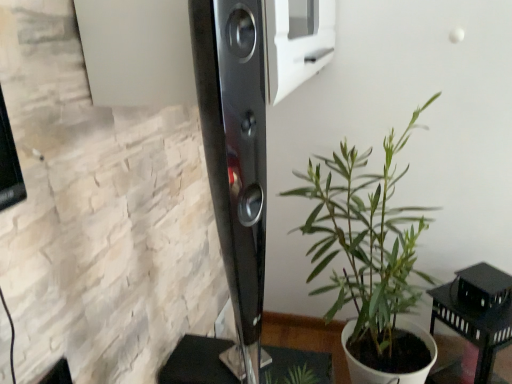
The image size is (512, 384). In order to click on green leafy plant at center in this screenshot , I will do `click(370, 261)`.

The width and height of the screenshot is (512, 384). Describe the element at coordinates (370, 261) in the screenshot. I see `green leafy plant at center` at that location.

What do you see at coordinates (477, 312) in the screenshot? I see `black matte table at lower right` at bounding box center [477, 312].

I want to click on black matte table at lower right, so click(x=477, y=312).

Identify the location of green leafy plant at center. The height and width of the screenshot is (384, 512). (370, 261).

Considering the positions of objects black matte table at lower right and green leafy plant at center in the image provided, who is more to the left, black matte table at lower right or green leafy plant at center?

green leafy plant at center.

Is black matte table at lower right closer to the viewer compared to green leafy plant at center?

That is False.

Which is in front, point (485, 264) or point (354, 367)?

Point (354, 367)

From the image's perspective, between black matte table at lower right and green leafy plant at center, which one is located above?

green leafy plant at center, from the image's perspective.

From a real-world perspective, between black matte table at lower right and green leafy plant at center, who is vertically higher?

green leafy plant at center.

Considering the sizes of objects black matte table at lower right and green leafy plant at center in the image provided, who is thinner, black matte table at lower right or green leafy plant at center?

Thinner between the two is black matte table at lower right.

Between black matte table at lower right and green leafy plant at center, which one has less height?

With less height is black matte table at lower right.

Does black matte table at lower right have a larger size compared to green leafy plant at center?

No, black matte table at lower right is not bigger than green leafy plant at center.

Is green leafy plant at center surrounded by black matte table at lower right?

No, green leafy plant at center is not inside black matte table at lower right.

Is black matte table at lower right far from green leafy plant at center?

No, black matte table at lower right is in close proximity to green leafy plant at center.

Is black matte table at lower right facing away from green leafy plant at center?

That's right, black matte table at lower right is facing away from green leafy plant at center.

What's the angular difference between black matte table at lower right and green leafy plant at center's facing directions?

black matte table at lower right and green leafy plant at center are facing 48.2 degrees away from each other.

Looking at this image, how much distance is there between black matte table at lower right and green leafy plant at center?

black matte table at lower right is 11.13 inches from green leafy plant at center.

Locate an element on the screen. houseplant that is above the black matte table at lower right (from the image's perspective) is located at coordinates (370, 261).

Is green leafy plant at center to the left of black matte table at lower right from the viewer's perspective?

Indeed, green leafy plant at center is positioned on the left side of black matte table at lower right.

Considering their positions, is green leafy plant at center located in front of or behind black matte table at lower right?

Clearly, green leafy plant at center is in front of black matte table at lower right.

Is point (411, 231) positioned before point (449, 292)?

No, it is not.

From the image's perspective, is green leafy plant at center above black matte table at lower right?

Yes.

From a real-world perspective, which object rests below the other?

black matte table at lower right, from a real-world perspective.

Based on the photo, is green leafy plant at center wider than black matte table at lower right?

Yes, green leafy plant at center is wider than black matte table at lower right.

In terms of height, does green leafy plant at center look taller or shorter compared to black matte table at lower right?

Clearly, green leafy plant at center is taller compared to black matte table at lower right.

In terms of size, does green leafy plant at center appear bigger or smaller than black matte table at lower right?

Clearly, green leafy plant at center is larger in size than black matte table at lower right.

Is black matte table at lower right surrounded by green leafy plant at center?

No, black matte table at lower right is not a part of green leafy plant at center.

Based on the photo, does green leafy plant at center touch black matte table at lower right?

No.

Is green leafy plant at center oriented towards black matte table at lower right?

Yes, green leafy plant at center is aimed at black matte table at lower right.

Can you tell me how much green leafy plant at center and black matte table at lower right differ in facing direction?

48.2 degrees.

In the scene shown: How much distance is there between green leafy plant at center and black matte table at lower right?

A distance of 11.13 inches exists between green leafy plant at center and black matte table at lower right.

Identify the location of furniture located on the right of green leafy plant at center. (477, 312).

Where is `furniture located on the right of green leafy plant at center`? furniture located on the right of green leafy plant at center is located at coordinates (477, 312).

Identify the location of furniture beneath the green leafy plant at center (from a real-world perspective). This screenshot has width=512, height=384. (477, 312).